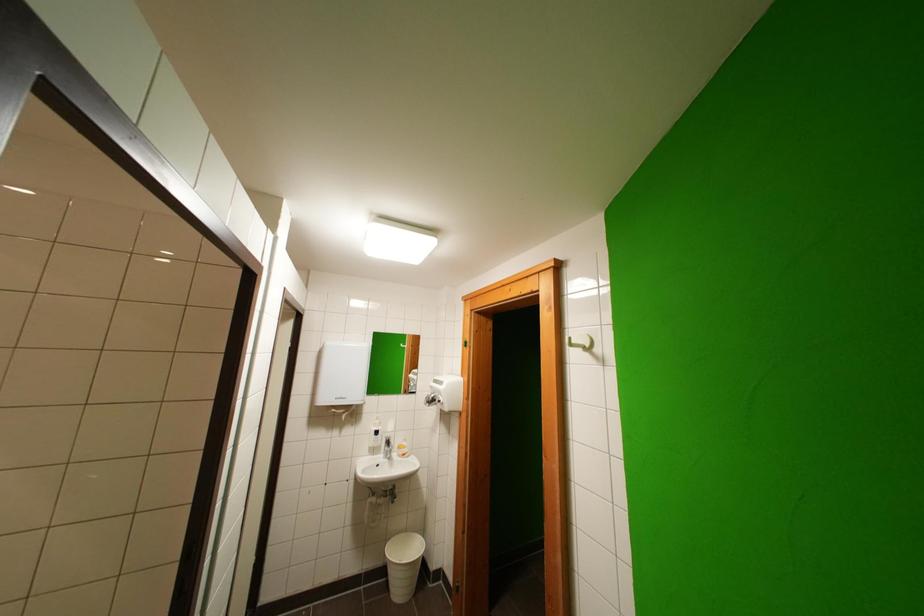
Locate an element on the screen. The image size is (924, 616). soap dispenser pump is located at coordinates (377, 422).